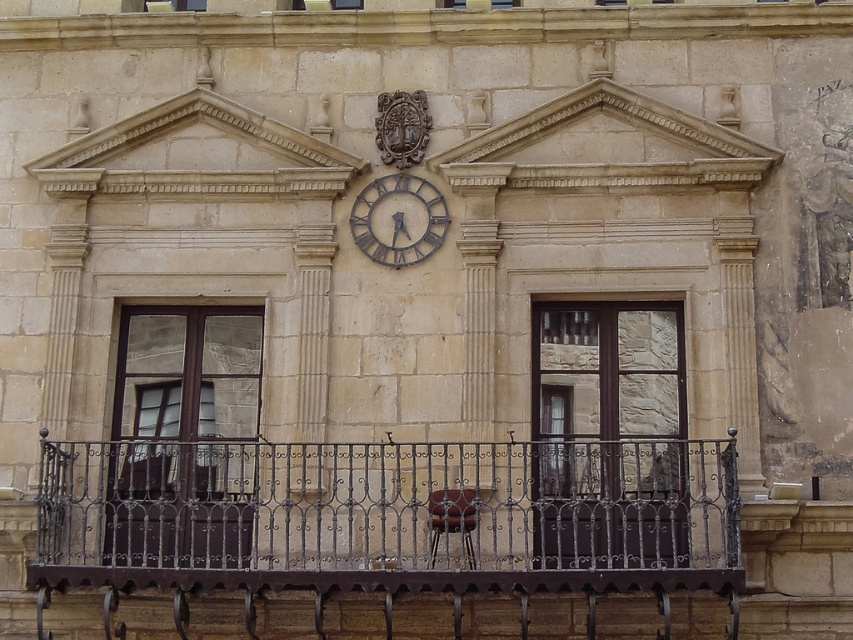
You are standing in front of the building and notice a point marked at coordinates [389,515]. What object at this location is part of the building?

The point at [389,515] corresponds to the dark brown wrought iron at center, which is part of the building.

You are an architect assessing the building facade. You notice the dark brown wrought iron at center and the rusty metal clock at center. Which of these two objects is bigger in size?

The dark brown wrought iron at center is larger in size compared to the rusty metal clock at center.

You are an architect inspecting the building facade. You notice the dark brown wrought iron at center and the rusty metal clock at center. Which object is positioned higher on the facade?

The rusty metal clock at center is positioned higher than the dark brown wrought iron at center because the dark brown wrought iron at center is located below the rusty metal clock at center.